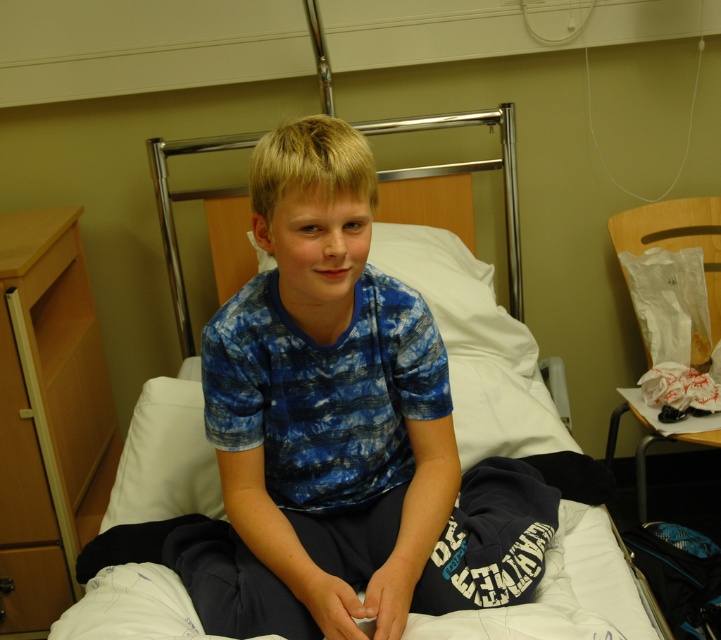
Can you confirm if blue tie-dye t-shirt at center is smaller than white soft pillow at center?

Correct, blue tie-dye t-shirt at center occupies less space than white soft pillow at center.

Between blue tie-dye t-shirt at center and white soft pillow at center, which one is positioned lower?

blue tie-dye t-shirt at center is lower down.

Which is behind, point (384, 440) or point (438, 253)?

Positioned behind is point (438, 253).

Find the location of a particular element. blue tie-dye t-shirt at center is located at coordinates (322, 390).

Does point (368, 513) come in front of point (497, 364)?

Yes.

Measure the distance between point (318, 490) and camera.

4.02 feet

Locate an element on the screen. The height and width of the screenshot is (640, 721). blue tie-dye shirt at center is located at coordinates (327, 394).

Can you confirm if white fabric hospital bed at center is smaller than white soft pillow at center?

No, white fabric hospital bed at center is not smaller than white soft pillow at center.

Is point (485, 461) positioned after point (455, 316)?

No.

Image resolution: width=721 pixels, height=640 pixels. I want to click on white fabric hospital bed at center, so click(468, 385).